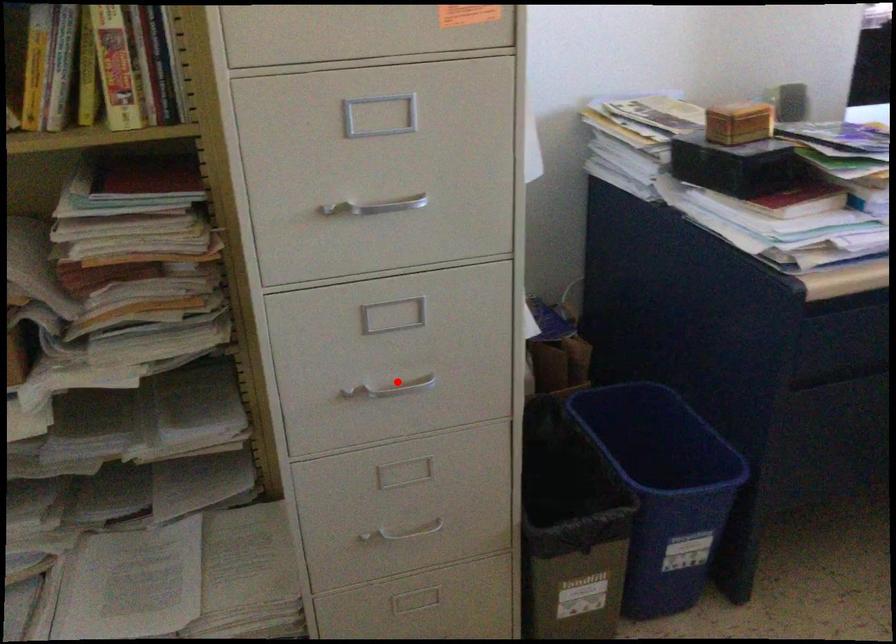
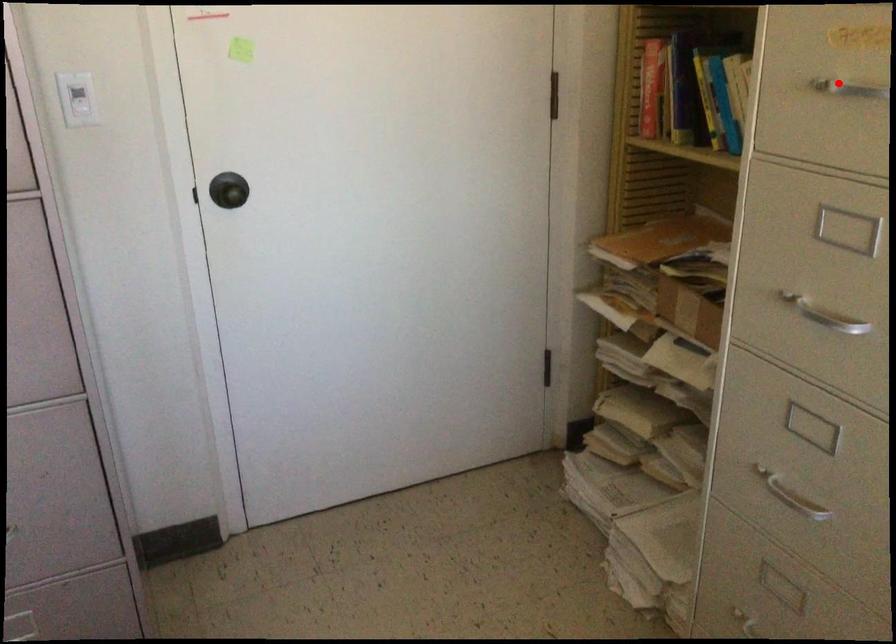
I am providing you with two images of the same scene from different viewpoints. A red point is marked on the first image and another point is marked on the second image. Are the points marked in image1 and image2 representing the same 3D position?

No